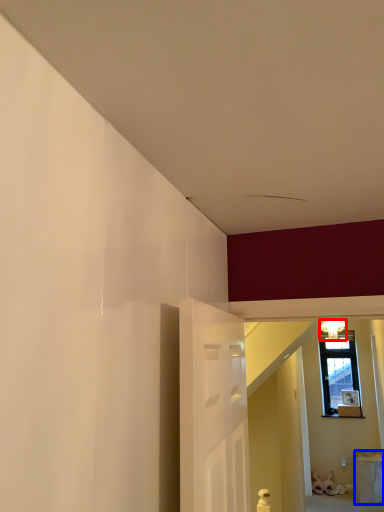
Question: Which point is closer to the camera, light fixture (highlighted by a red box) or furniture (highlighted by a blue box)?

Choices:
 (A) light fixture
 (B) furniture

Answer: (A)